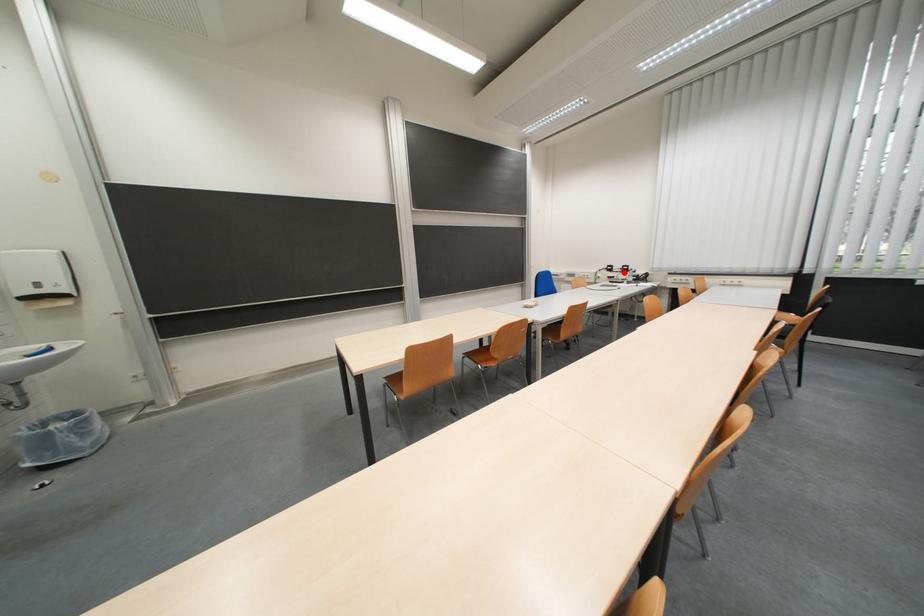
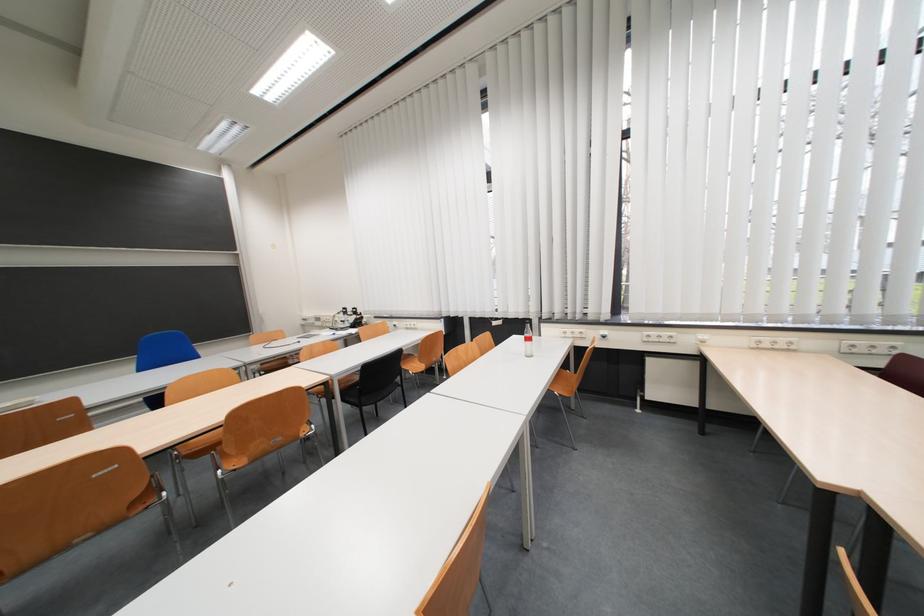
The point at the highlighted location is marked in the first image. Where is the corresponding point in the second image?

(357, 315)